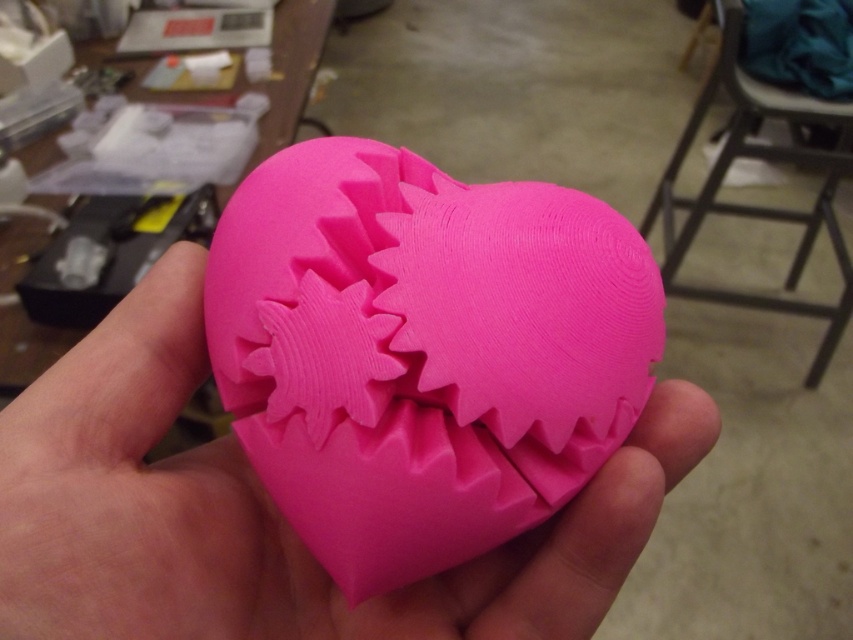
Consider the image. You are an interior designer planning to place a decorative item in a small living room. You have the pink matte heart at center and the metallic gray stool at upper right. If you want to place them 2 meters apart, will their current distance in the image work?

The pink matte heart at center and metallic gray stool at upper right are 1.92 meters apart, which is slightly less than 2 meters. Therefore, their current distance in the image would not be sufficient for the 2 meter requirement.

Looking at this image, you are an artist working in a cluttered workshop. You need to place a new tool exactly at the coordinates where the pink matte heart at center is located. What are the coordinates you should aim for?

You should aim for the coordinates point (267, 509) where the pink matte heart at center is located.